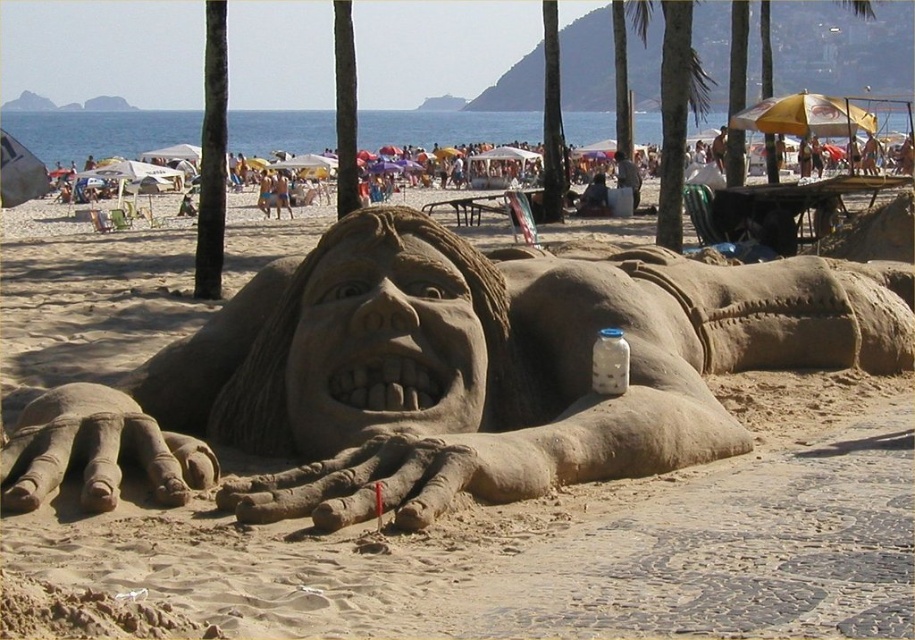
Question: Based on their relative distances, which object is nearer to the green leafy palm tree at upper center?

Choices:
 (A) transparent glass bottle at center
 (B) smooth sand sculpture at center

Answer: (B)

Question: Which point appears farthest from the camera in this image?

Choices:
 (A) (615, 362)
 (B) (661, 108)
 (C) (666, 401)

Answer: (B)

Question: Is smooth sand sculpture at center behind transparent glass bottle at center?

Choices:
 (A) no
 (B) yes

Answer: (A)

Question: Is green leafy palm tree at upper center positioned at the back of transparent glass bottle at center?

Choices:
 (A) no
 (B) yes

Answer: (B)

Question: Is smooth sand sculpture at center bigger than green leafy palm tree at upper center?

Choices:
 (A) yes
 (B) no

Answer: (B)

Question: Among these points, which one is nearest to the camera?

Choices:
 (A) (603, 353)
 (B) (674, 1)

Answer: (A)